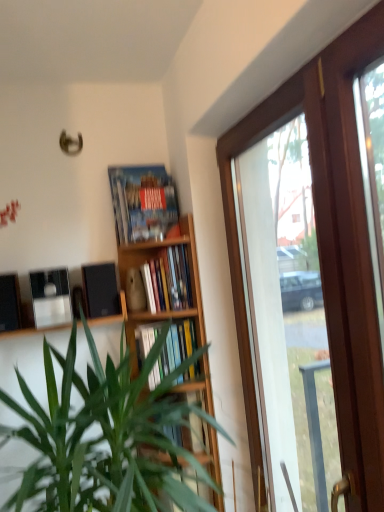
Question: Should I look upward or downward to see matte black shelf at center, the first shelf when ordered from top to bottom?

Choices:
 (A) up
 (B) down

Answer: (B)

Question: Could you tell me if black matte speaker at lower left, which is the second loudspeaker from left to right, is facing wooden bookcase at center?

Choices:
 (A) yes
 (B) no

Answer: (B)

Question: Considering the relative sizes of black matte speaker at lower left, which is the first loudspeaker from right to left, and wooden bookcase at center in the image provided, is black matte speaker at lower left, which is the first loudspeaker from right to left, thinner than wooden bookcase at center?

Choices:
 (A) no
 (B) yes

Answer: (B)

Question: Is black matte speaker at lower left, which is the second loudspeaker from left to right, positioned far away from wooden bookcase at center?

Choices:
 (A) no
 (B) yes

Answer: (A)

Question: Is black matte speaker at lower left, which is the second loudspeaker from left to right, looking in the opposite direction of wooden bookcase at center?

Choices:
 (A) yes
 (B) no

Answer: (B)

Question: Is black matte speaker at lower left, which is the first loudspeaker from right to left, completely or partially outside of wooden bookcase at center?

Choices:
 (A) yes
 (B) no

Answer: (A)

Question: Is black matte speaker at lower left, which is the first loudspeaker from right to left, beside wooden bookcase at center?

Choices:
 (A) yes
 (B) no

Answer: (B)

Question: Considering the relative sizes of wooden bookcase at center and black matte speaker at left, which ranks as the 2th loudspeaker in right-to-left order, in the image provided, is wooden bookcase at center thinner than black matte speaker at left, which ranks as the 2th loudspeaker in right-to-left order,?

Choices:
 (A) no
 (B) yes

Answer: (A)

Question: From a real-world perspective, is wooden bookcase at center physically below black matte speaker at left, which ranks as the 2th loudspeaker in right-to-left order?

Choices:
 (A) yes
 (B) no

Answer: (A)

Question: Considering the relative positions of wooden bookcase at center and black matte speaker at left, the first loudspeaker positioned from the left, in the image provided, is wooden bookcase at center to the right of black matte speaker at left, the first loudspeaker positioned from the left, from the viewer's perspective?

Choices:
 (A) no
 (B) yes

Answer: (B)

Question: Considering the relative positions of wooden bookcase at center and black matte speaker at left, which ranks as the 2th loudspeaker in right-to-left order, in the image provided, is wooden bookcase at center in front of black matte speaker at left, which ranks as the 2th loudspeaker in right-to-left order,?

Choices:
 (A) no
 (B) yes

Answer: (A)

Question: From the image's perspective, does wooden bookcase at center appear higher than black matte speaker at left, the first loudspeaker positioned from the left?

Choices:
 (A) yes
 (B) no

Answer: (B)

Question: Does wooden bookcase at center have a larger size compared to black matte speaker at left, the first loudspeaker positioned from the left?

Choices:
 (A) yes
 (B) no

Answer: (A)

Question: Does black matte speaker at left, which ranks as the 2th loudspeaker in right-to-left order, appear on the left side of wooden frame at right?

Choices:
 (A) no
 (B) yes

Answer: (B)